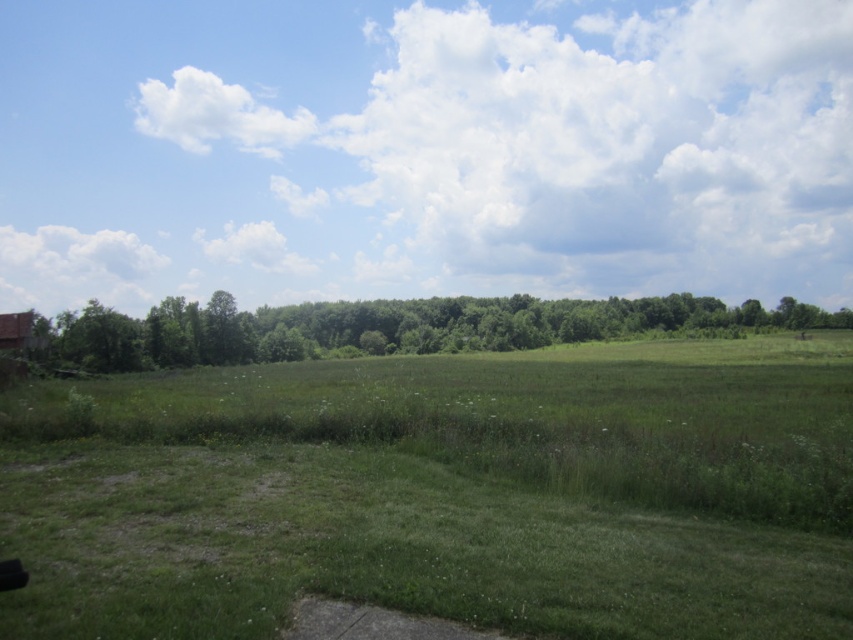
You are standing at the bottom center of the image where the concrete path is. You see two points marked in the scene. Which point, point (552, 413) or point (662, 323), is closer to you?

Point (552, 413) is closer to the viewer than point (662, 323).

You are standing at the bottom of the image and want to walk towards the green leafy trees at center. Is the green grassy pasture at center blocking your path?

The green grassy pasture at center is in front of the green leafy trees at center, so it is blocking your path to the trees.